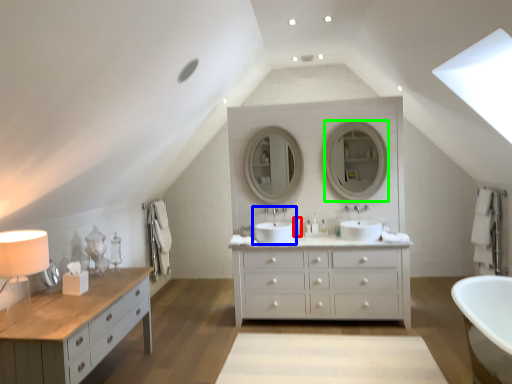
Question: Which object is positioned farthest from toiletry (highlighted by a red box)? Select from sink (highlighted by a blue box) and mirror (highlighted by a green box).

Choices:
 (A) sink
 (B) mirror

Answer: (B)